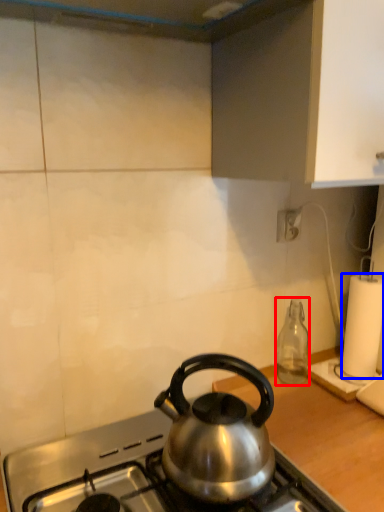
Question: Among these objects, which one is nearest to the camera, bottle (highlighted by a red box) or paper towel (highlighted by a blue box)?

Choices:
 (A) bottle
 (B) paper towel

Answer: (A)